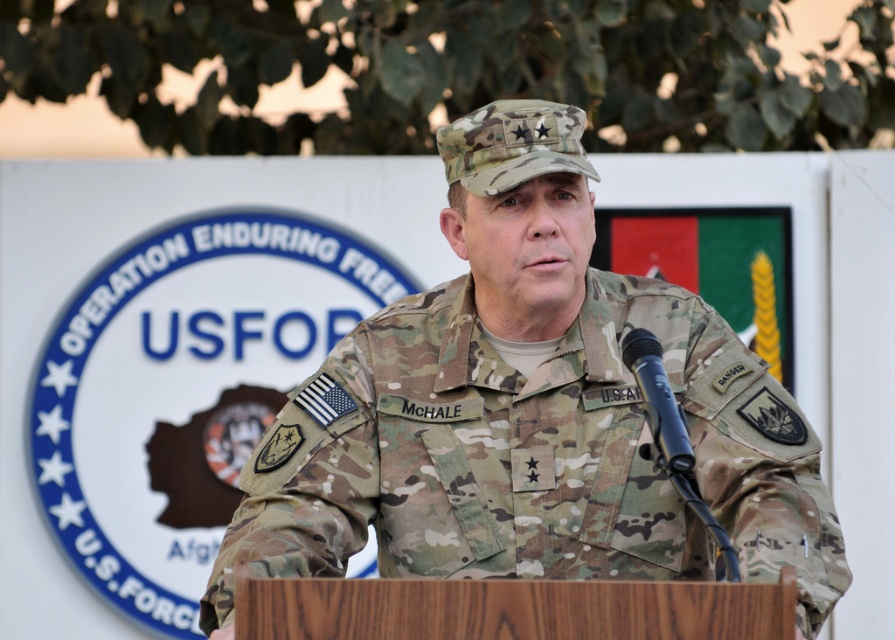
In the scene shown: What are the coordinates of the camo uniform at center?

The coordinates of the camo uniform at center are at point [529,412].